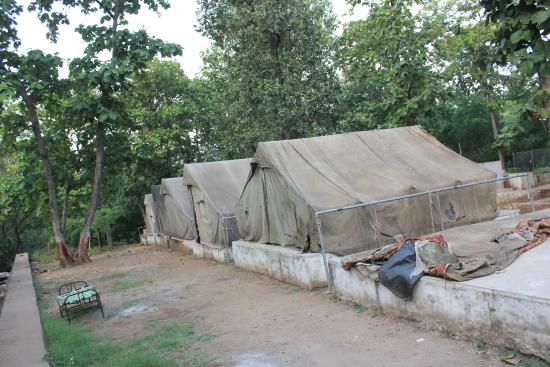
Locate an element on the screen. This screenshot has width=550, height=367. bed is located at coordinates (77, 298).